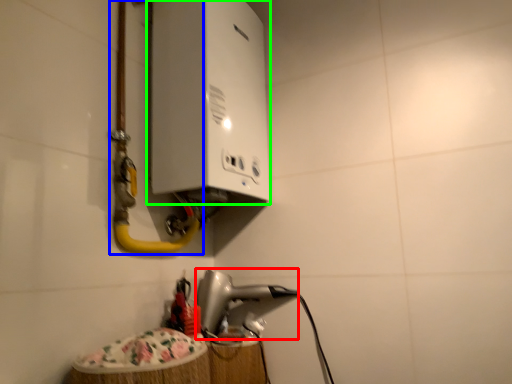
Question: Which object is the farthest from appliance (highlighted by a red box)? Choose among these: water pipe (highlighted by a blue box) or appliance (highlighted by a green box).

Choices:
 (A) water pipe
 (B) appliance

Answer: (B)